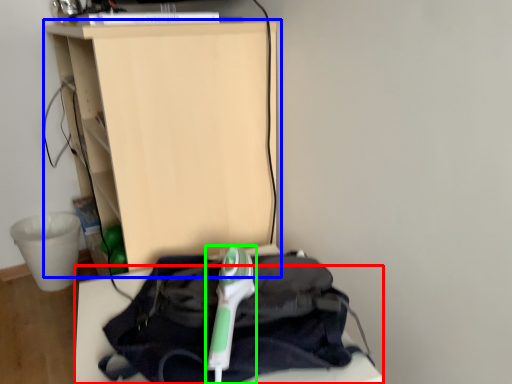
Question: Which object is positioned farthest from furniture (highlighted by a red box)? Select from furniture (highlighted by a blue box) and equipment (highlighted by a green box).

Choices:
 (A) furniture
 (B) equipment

Answer: (A)